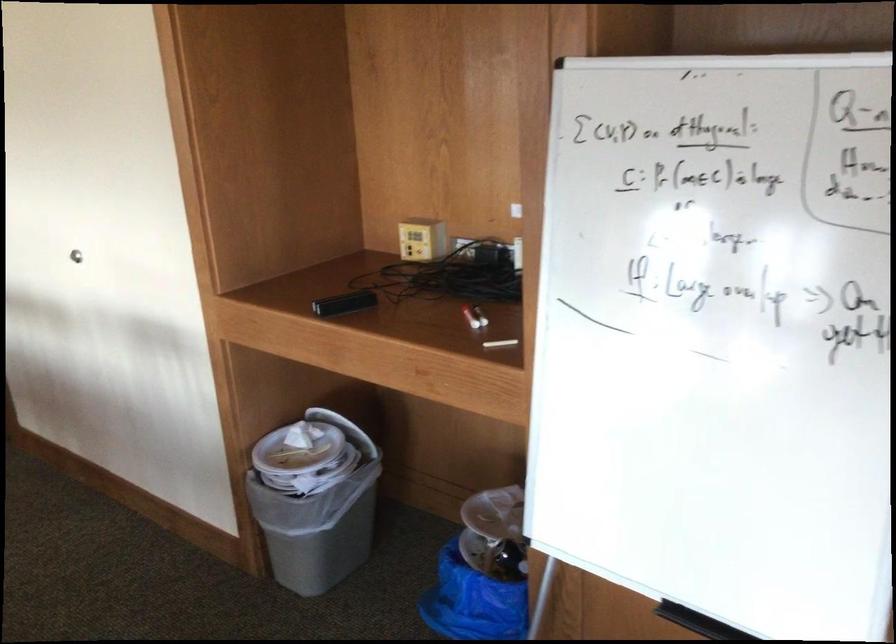
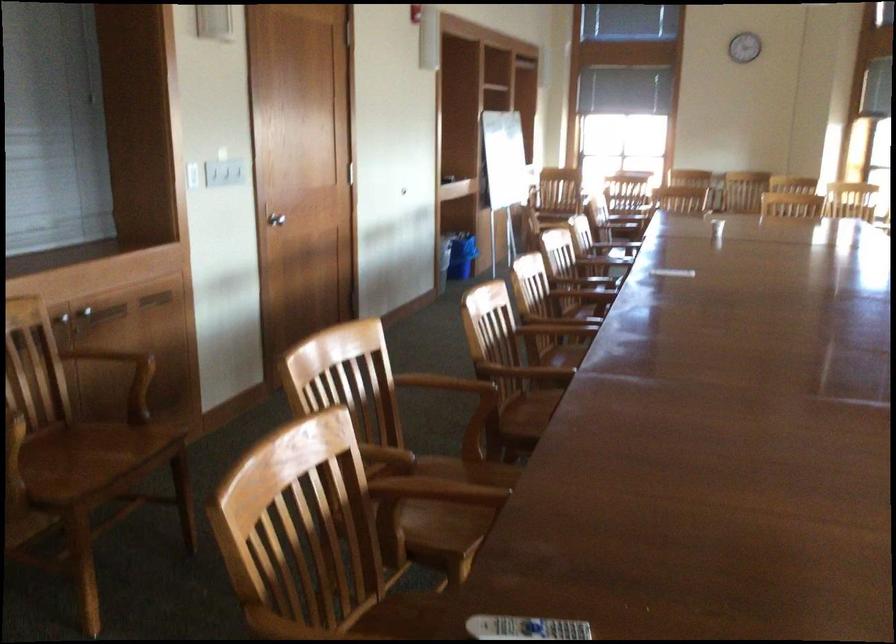
Question: I am providing you with two images of the same scene from different viewpoints. Which of the following objects are not visible in image2?

Choices:
 (A) silver door handle
 (B) cardboard mailer
 (C) white paper plate
 (D) blue trash can

Answer: (C)